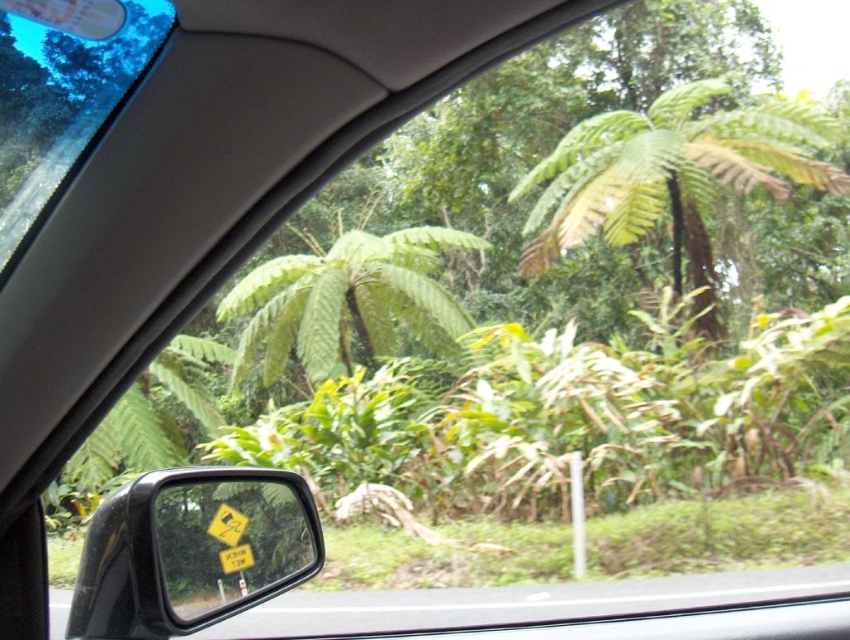
Can you confirm if black glossy view mirror at lower left is positioned above transparent glass car window at upper left?

Actually, black glossy view mirror at lower left is below transparent glass car window at upper left.

Does black glossy view mirror at lower left appear under transparent glass car window at upper left?

Yes.

The height and width of the screenshot is (640, 850). Describe the element at coordinates (191, 550) in the screenshot. I see `black glossy view mirror at lower left` at that location.

Locate an element on the screen. This screenshot has width=850, height=640. black glossy view mirror at lower left is located at coordinates (191, 550).

Does black glossy view mirror at lower left have a larger size compared to green leafy tree at center?

Actually, black glossy view mirror at lower left might be smaller than green leafy tree at center.

What do you see at coordinates (191, 550) in the screenshot?
I see `black glossy view mirror at lower left` at bounding box center [191, 550].

Looking at this image, measure the distance between black glossy view mirror at lower left and camera.

black glossy view mirror at lower left is 8.49 meters away from camera.

Find the location of a particular element. The width and height of the screenshot is (850, 640). black glossy view mirror at lower left is located at coordinates (191, 550).

From the picture: Who is positioned more to the left, green leafy tree at upper center or black glossy view mirror at lower left?

black glossy view mirror at lower left is more to the left.

Does green leafy tree at upper center have a lesser height compared to black glossy view mirror at lower left?

No.

What do you see at coordinates (670, 168) in the screenshot? I see `green leafy tree at upper center` at bounding box center [670, 168].

Identify the location of green leafy tree at upper center. The height and width of the screenshot is (640, 850). (670, 168).